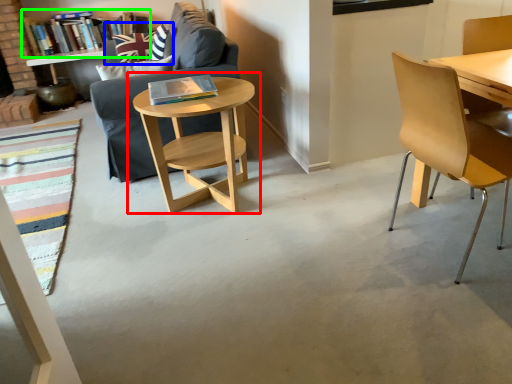
Question: Which object is the closest to the table (highlighted by a red box)? Choose among these: pillow (highlighted by a blue box) or book (highlighted by a green box).

Choices:
 (A) pillow
 (B) book

Answer: (A)